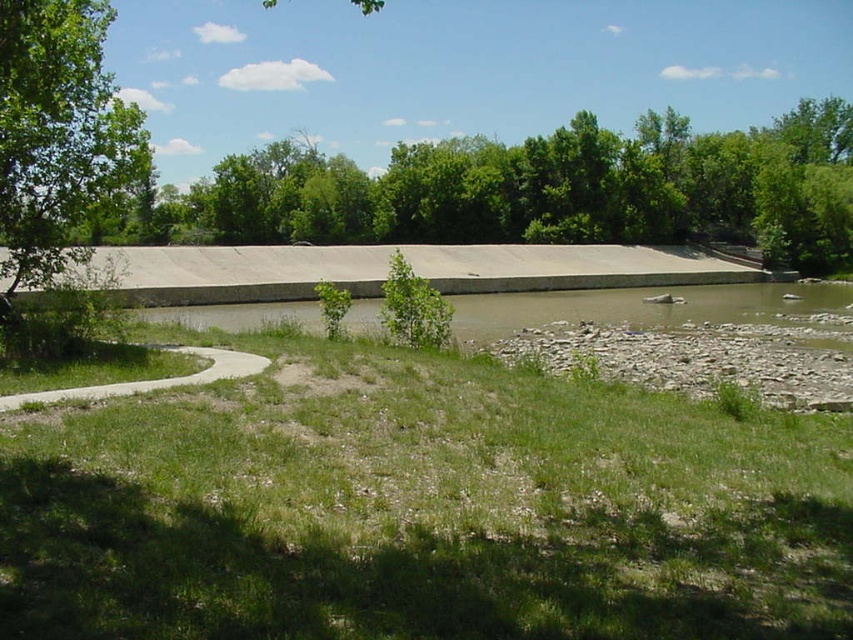
You are standing at the center of the dam structure and want to reach the green grass at lower center. Which direction should you walk to get there?

You should walk towards the lower center direction to reach the green grass at lower center.

You are standing at the center of the image and want to know which object is wider between the green leafy tree at upper left and the concrete at left. Can you determine which one is wider?

The green leafy tree at upper left is wider than the concrete at left according to the description.